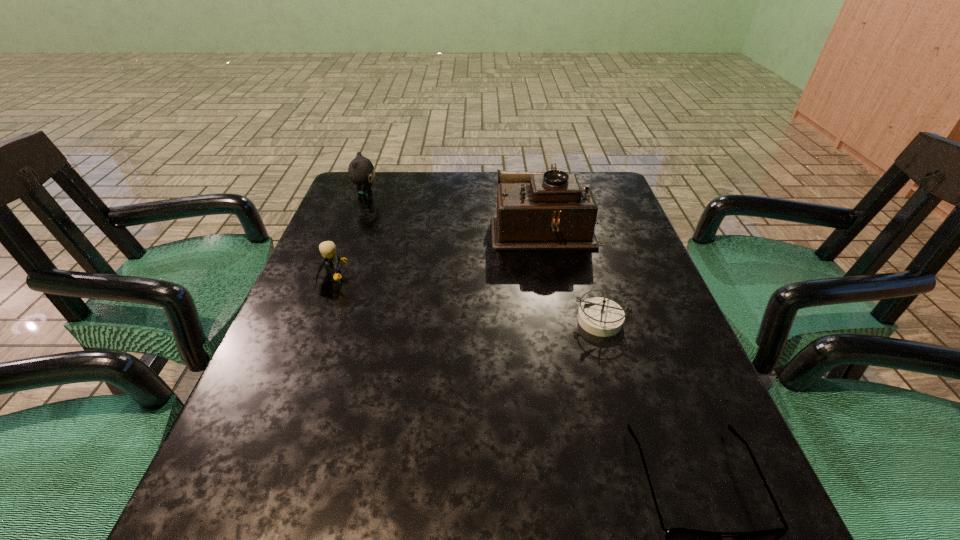
The width and height of the screenshot is (960, 540). Identify the location of phonograph_record. (535, 211).

Identify the location of the fourth shortest object. (361, 171).

Find the location of a particular element. The image size is (960, 540). Lego is located at coordinates (330, 259).

Where is `the third shortest object`? This screenshot has height=540, width=960. the third shortest object is located at coordinates pos(330,259).

Image resolution: width=960 pixels, height=540 pixels. I want to click on the fourth farthest object, so click(599, 316).

Locate an element on the screen. The width and height of the screenshot is (960, 540). free space located on the horn of the tallest object is located at coordinates (346, 227).

At what (x,y) coordinates should I click in order to perform the action: click on free space located 0.250m on the horn of the tallest object. Please return your answer as a coordinate pair (x, y). This screenshot has height=540, width=960. Looking at the image, I should click on (396, 227).

At what (x,y) coordinates should I click in order to perform the action: click on free region located 0.070m on the horn of the tallest object. Please return your answer as a coordinate pair (x, y). Looking at the image, I should click on (465, 227).

Identify the location of free location located on the front-facing side of the second tallest object. This screenshot has width=960, height=540. (445, 197).

Identify the location of free region located 0.150m on the front-facing side of the third nearest object. (413, 278).